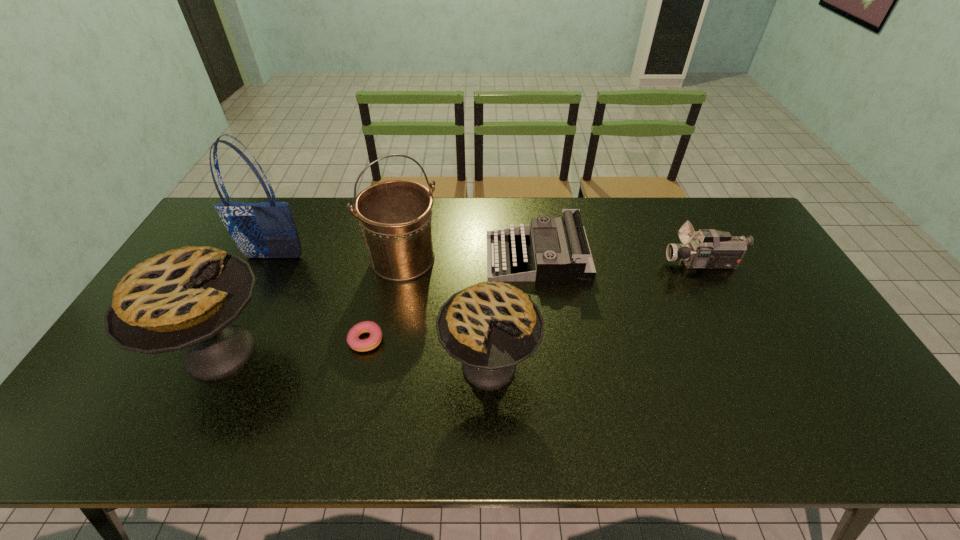
This screenshot has width=960, height=540. Identify the location of typewriter that is at the far edge. (554, 249).

This screenshot has height=540, width=960. In order to click on bucket positioned at the far edge in this screenshot , I will do `click(395, 216)`.

Where is `object present at the left edge`? Image resolution: width=960 pixels, height=540 pixels. object present at the left edge is located at coordinates (188, 297).

What are the coordinates of `object that is at the right edge` in the screenshot? It's located at (710, 249).

What are the coordinates of `object that is at the near left corner` in the screenshot? It's located at (188, 297).

Locate an element on the screen. This screenshot has width=960, height=540. free space at the far edge is located at coordinates (486, 223).

In the image, there is a desktop. Find the location of `vacant space at the near edge`. vacant space at the near edge is located at coordinates (608, 406).

Locate an element on the screen. Image resolution: width=960 pixels, height=540 pixels. free region at the right edge is located at coordinates (758, 307).

At what (x,y) coordinates should I click in order to perform the action: click on empty space that is in between the fourth tallest object and the fifth shortest object. Please return your answer as a coordinate pair (x, y). Looking at the image, I should click on (355, 359).

Locate an element on the screen. free space that is in between the shortest object and the camcorder is located at coordinates (535, 302).